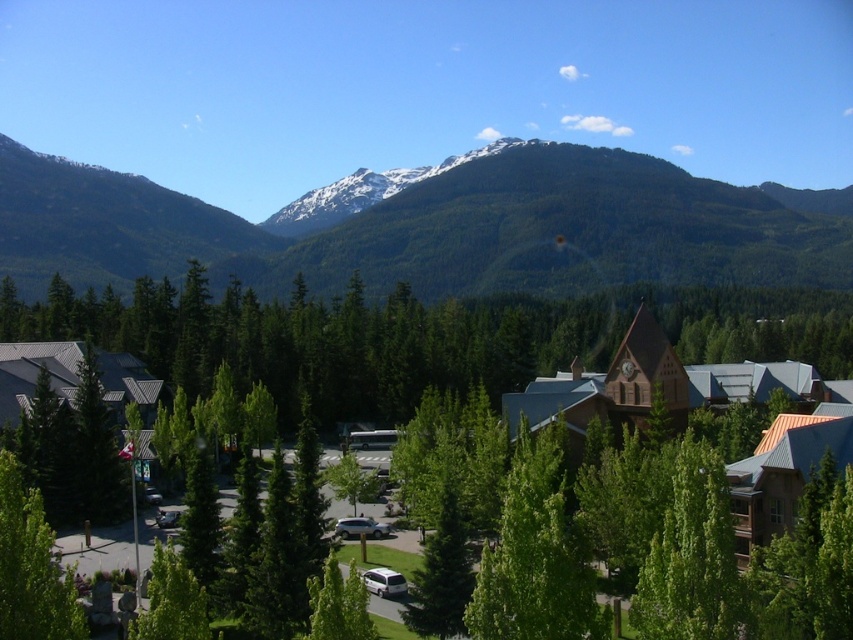
You are standing at the edge of the road in the middle ground of the mountain landscape. You see the green matte tree at center and the green matte tree at lower left. Which tree is closer to you?

The green matte tree at center is closer to you because the green matte tree at lower left is behind it.